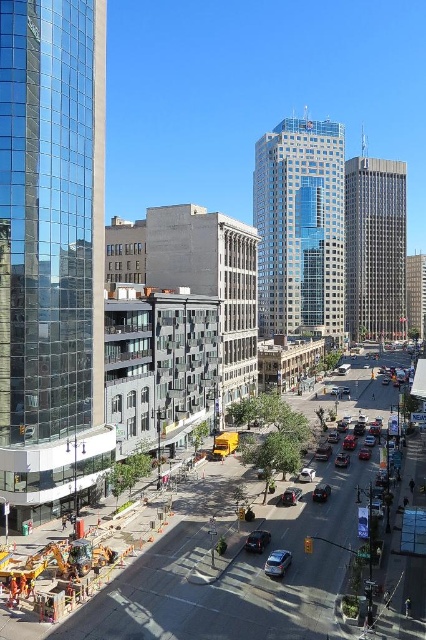
Question: Considering the relative positions of satin silver sedan at center and shiny black sedan at center in the image provided, where is satin silver sedan at center located with respect to shiny black sedan at center?

Choices:
 (A) left
 (B) right

Answer: (B)

Question: Which object appears closest to the camera in this image?

Choices:
 (A) satin black sedan at center
 (B) concrete construction site at lower left

Answer: (B)

Question: Is concrete construction site at lower left to the right of satin silver sedan at center from the viewer's perspective?

Choices:
 (A) yes
 (B) no

Answer: (A)

Question: Which point is farther to the camera?

Choices:
 (A) satin silver sedan at center
 (B) satin black sedan at center
 (C) shiny black sedan at center
 (D) concrete construction site at lower left

Answer: (B)

Question: Is concrete construction site at lower left thinner than satin silver sedan at center?

Choices:
 (A) no
 (B) yes

Answer: (A)

Question: Which object is farther from the camera taking this photo?

Choices:
 (A) shiny black sedan at center
 (B) concrete construction site at lower left

Answer: (A)